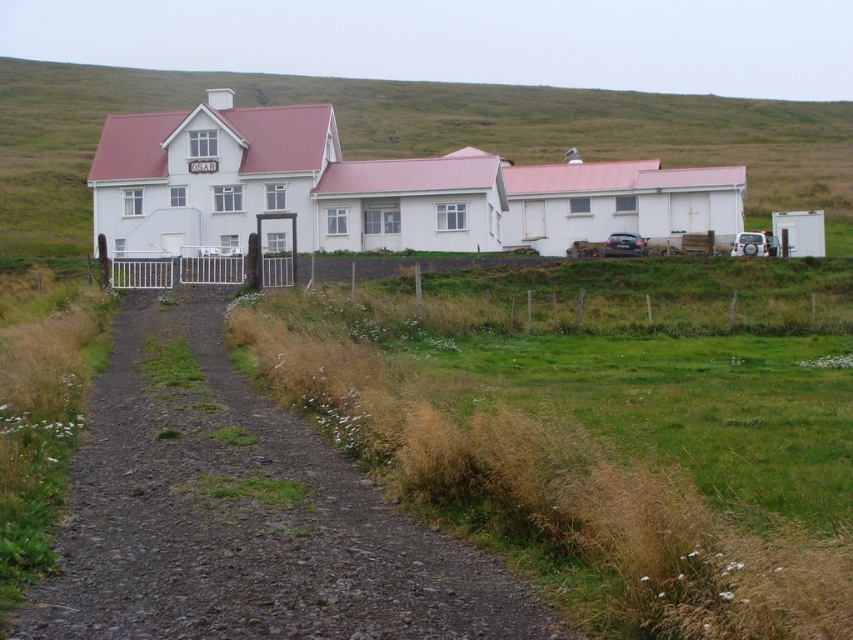
Question: Does green grassy hillside at upper center appear under metallic silver car at right?

Choices:
 (A) yes
 (B) no

Answer: (B)

Question: Can you confirm if green grassy hillside at upper center is thinner than metallic silver car at right?

Choices:
 (A) yes
 (B) no

Answer: (B)

Question: Which of the following is the farthest from the observer?

Choices:
 (A) silver metallic suv at right
 (B) green grassy hillside at upper center
 (C) green grassy at lower left

Answer: (B)

Question: Which is nearer to the dirt/gravel path at center?

Choices:
 (A) silver metallic suv at right
 (B) metallic silver car at right

Answer: (B)

Question: In this image, where is green grassy at lower left located relative to silver metallic suv at right?

Choices:
 (A) left
 (B) right

Answer: (A)

Question: Considering the real-world distances, which object is farthest from the dirt/gravel path at center?

Choices:
 (A) silver metallic suv at right
 (B) green grassy hillside at upper center
 (C) metallic silver car at right
 (D) green grassy at lower left

Answer: (B)